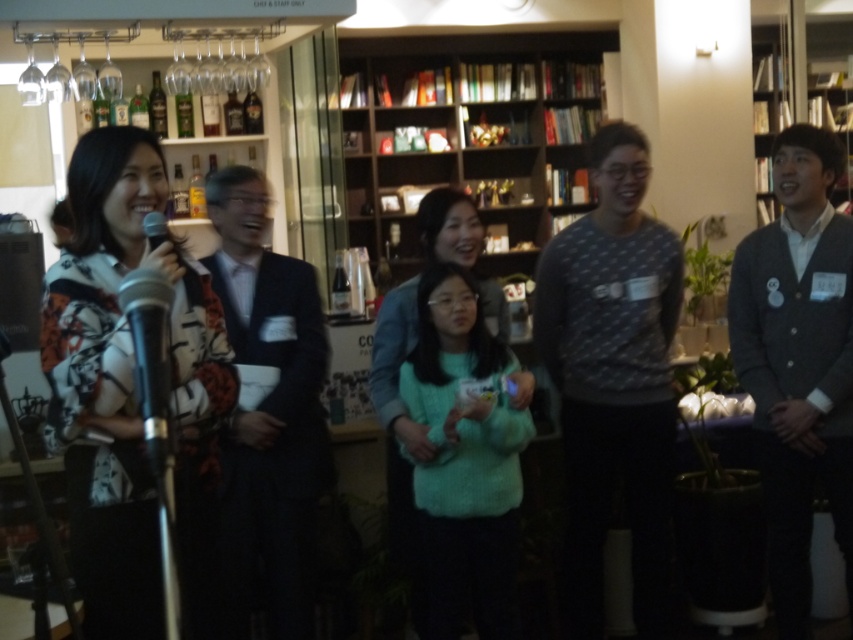
Question: Which point is farther from the camera taking this photo?

Choices:
 (A) (482, 154)
 (B) (331, 480)

Answer: (A)

Question: Where is dark gray suit at right located in relation to dark suit at center in the image?

Choices:
 (A) left
 (B) right

Answer: (B)

Question: Can you confirm if dark gray suit at right is thinner than dark suit at center?

Choices:
 (A) no
 (B) yes

Answer: (A)

Question: Among these points, which one is nearest to the camera?

Choices:
 (A) (241, 470)
 (B) (418, 164)
 (C) (750, 243)

Answer: (A)

Question: Can you confirm if dark gray suit at right is smaller than dark suit at center?

Choices:
 (A) no
 (B) yes

Answer: (B)

Question: Which point is closer to the camera?

Choices:
 (A) (310, 506)
 (B) (497, 262)
 (C) (778, 337)

Answer: (A)